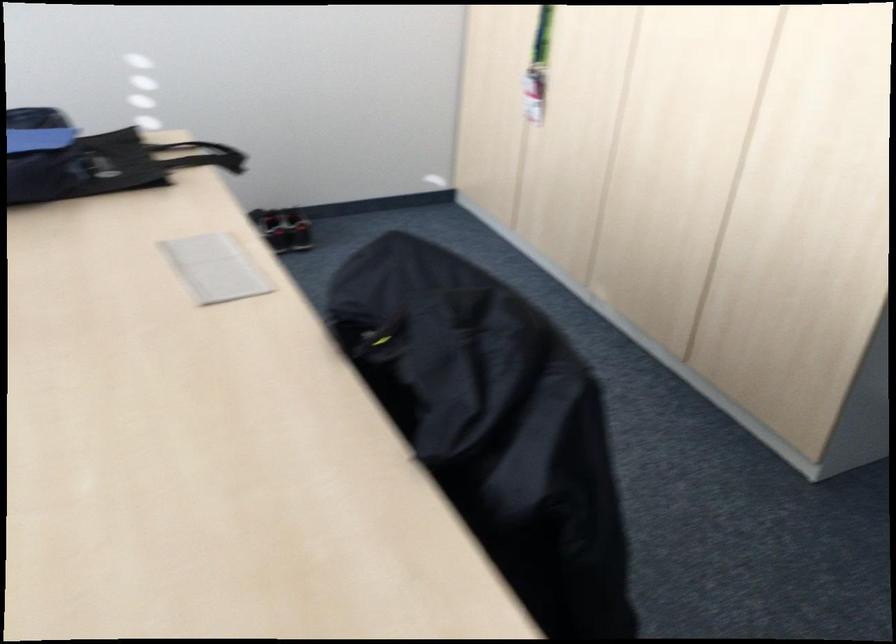
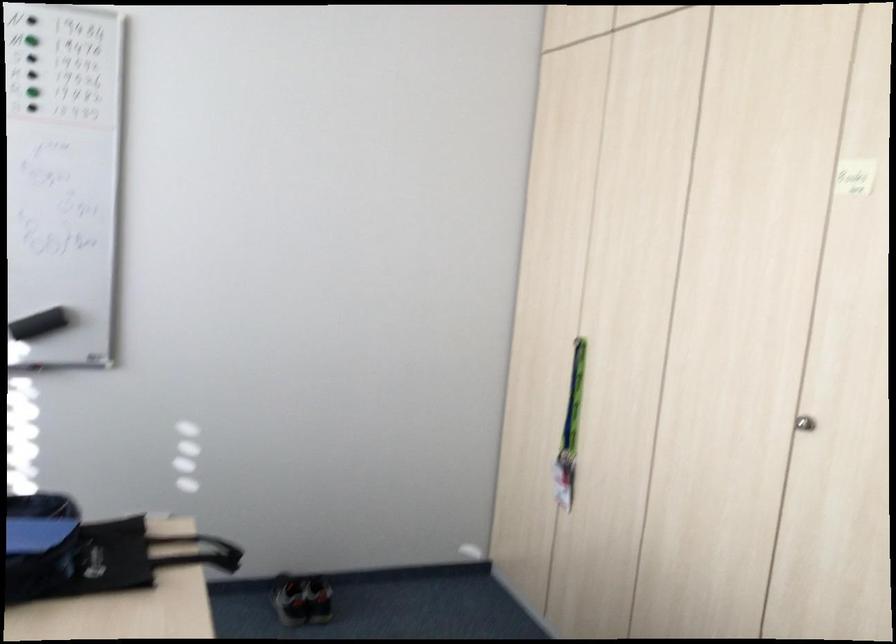
Question: Based on the continuous images, in which direction is the camera rotating? Reply with the corresponding letter.

Choices:
 (A) Left
 (B) Right
 (C) Up
 (D) Down

Answer: (C)